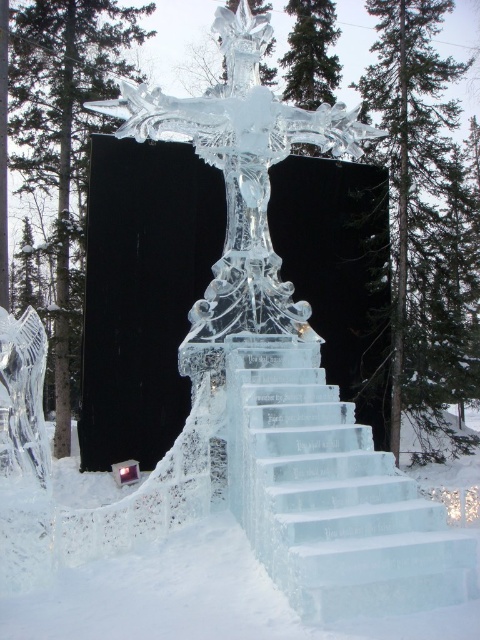
You are an ice sculptor standing at the base of the clear ice stairs at center. You want to climb up to the top of the clear ice sculpture at center. Can you step directly from the stairs onto the sculpture?

The clear ice stairs at center might be wider than clear ice sculpture at center, so there might be a gap between them. You might not be able to step directly from the stairs onto the sculpture without risking a fall. It would be safer to check the distance first.

Based on the photo, you are standing in front of the ice sculpture and want to climb up to the top. Which object should you approach first, the clear ice stairs at center or the clear ice sculpture at center?

You should approach the clear ice stairs at center first because it is to the right of the clear ice sculpture at center, indicating it might be the accessible path leading upwards.

You are an ice sculptor who wants to place a new ice ornament between the clear ice stairs at center and the clear ice sculpture at center. Given that the ornament requires 10 feet of space to fit properly, can you fit it between them?

The clear ice stairs at center and clear ice sculpture at center are 20.77 feet apart, so yes, the ornament can be placed between them as there is sufficient space.